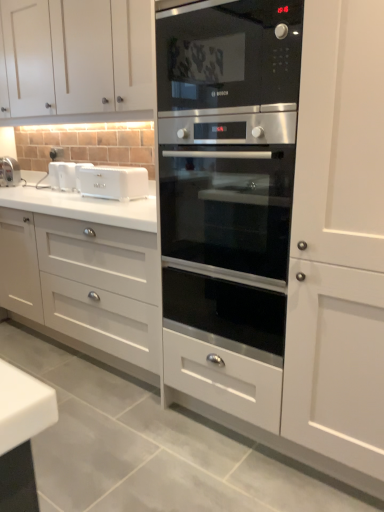
Question: Do you think black glass microwave at center is within white plastic toaster at center, the second appliance in the back-to-front sequence, or outside of it?

Choices:
 (A) inside
 (B) outside

Answer: (B)

Question: Considering the positions of point (180, 90) and point (122, 189), is point (180, 90) closer or farther from the camera than point (122, 189)?

Choices:
 (A) farther
 (B) closer

Answer: (B)

Question: Which is nearer to the stainless steel oven at center?

Choices:
 (A) white plastic toaster at center, marked as the first appliance in a right-to-left arrangement
 (B) white plastic toaster at left, the first appliance from the left
 (C) matte white faucet at left
 (D) white matte cabinet at upper left
 (E) black glass microwave at center

Answer: (E)

Question: Considering the real-world distances, which object is closest to the stainless steel oven at center?

Choices:
 (A) white plastic toaster at center, the second appliance in the back-to-front sequence
 (B) black glass microwave at center
 (C) matte white faucet at left
 (D) white plastic toaster at left, which appears as the first appliance when viewed from the back
 (E) white matte cabinet at upper left

Answer: (B)